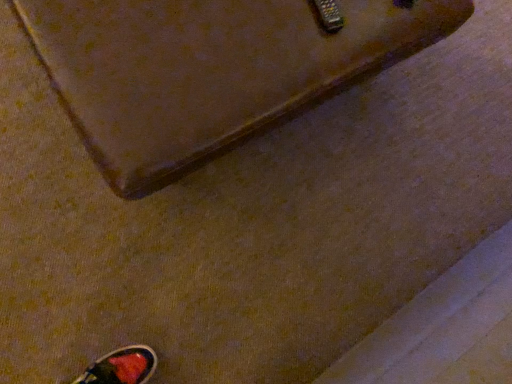
The height and width of the screenshot is (384, 512). I want to click on vacant area that is in front of leather suitcase at upper center, so click(x=149, y=247).